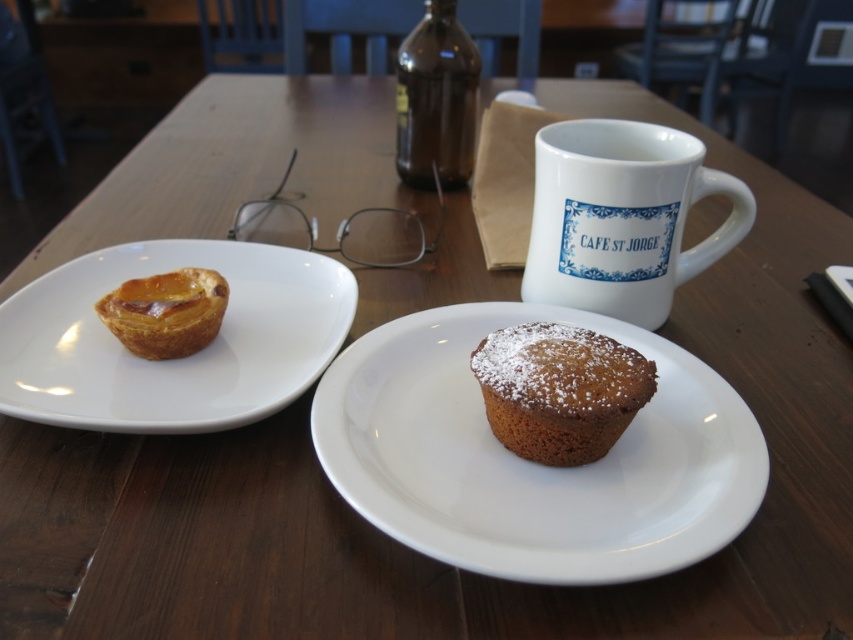
Question: From the image, what is the correct spatial relationship of brown matte cupcake at center in relation to powdered brown cupcake at center?

Choices:
 (A) left
 (B) right

Answer: (A)

Question: Which point is closer to the camera?

Choices:
 (A) golden brown flaky pastry at upper left
 (B) brown glass bottle at upper center
 (C) brown matte cupcake at center
 (D) white ceramic mug at upper right

Answer: (C)

Question: In this image, where is brown matte cupcake at center located relative to white glossy plate at left?

Choices:
 (A) below
 (B) above

Answer: (A)

Question: Which point appears closest to the camera in this image?

Choices:
 (A) (610, 486)
 (B) (102, 314)

Answer: (A)

Question: Is white glossy plate at left closer to the viewer compared to golden brown flaky pastry at upper left?

Choices:
 (A) no
 (B) yes

Answer: (B)

Question: Considering the real-world distances, which object is farthest from the golden brown flaky pastry at upper left?

Choices:
 (A) brown glass bottle at upper center
 (B) white ceramic mug at upper right

Answer: (A)